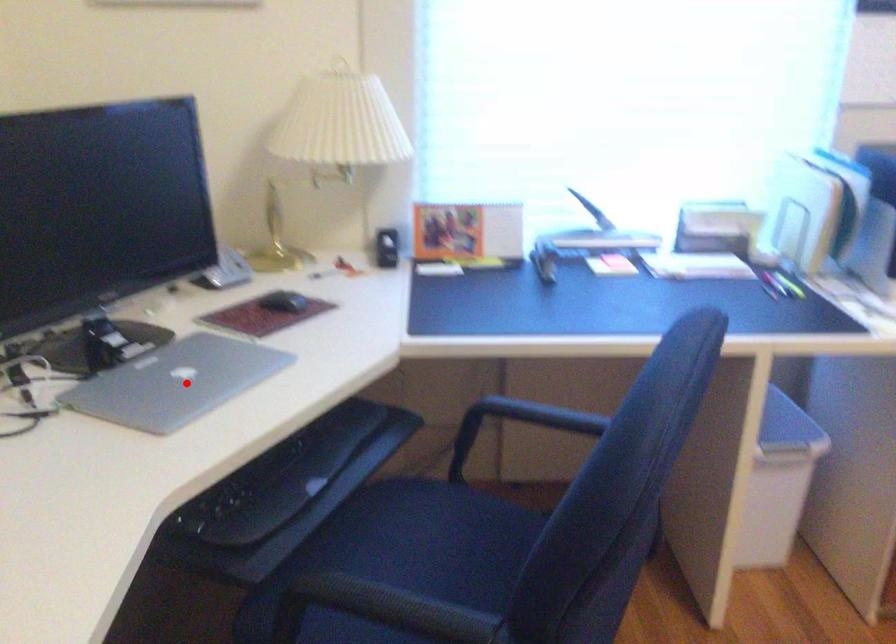
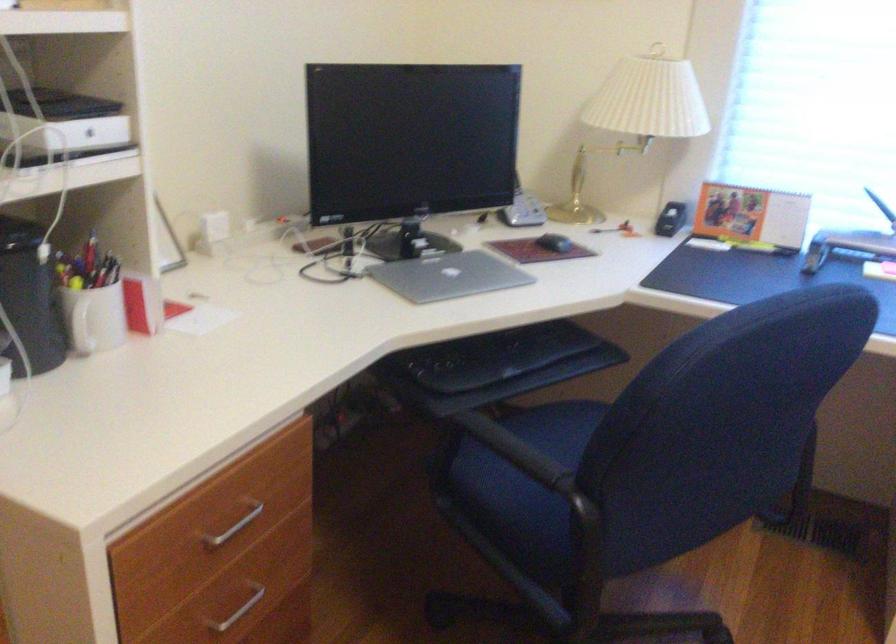
Locate, in the second image, the point that corresponds to the highlighted location in the first image.

(449, 276)